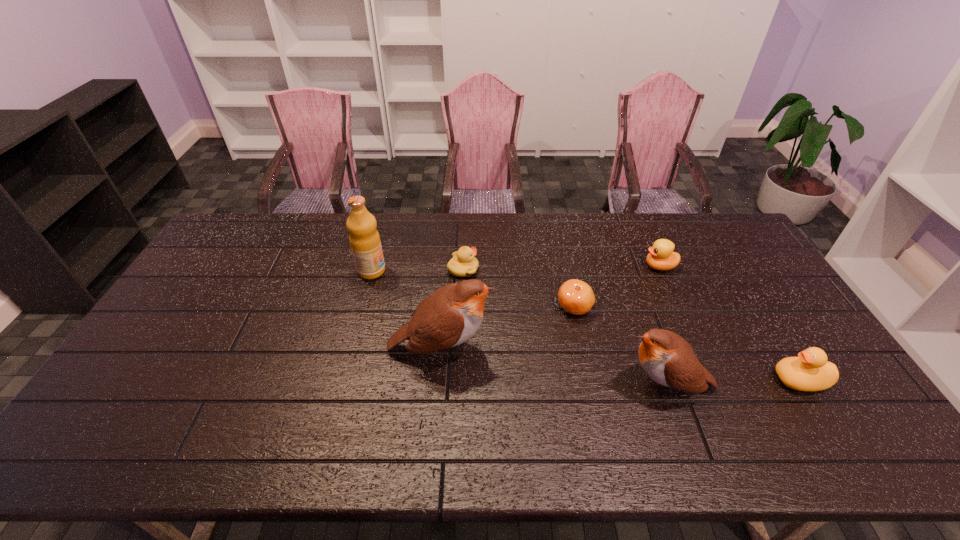
Image resolution: width=960 pixels, height=540 pixels. What are the coordinates of `object that stands as the closest to the left duckling` in the screenshot? It's located at pyautogui.click(x=451, y=315).

Identify which object is located as the third nearest to the fruit juice. Please provide its 2D coordinates. Your answer should be formatted as a tuple, i.e. [(x, y)], where the tuple contains the x and y coordinates of a point satisfying the conditions above.

[(576, 297)]